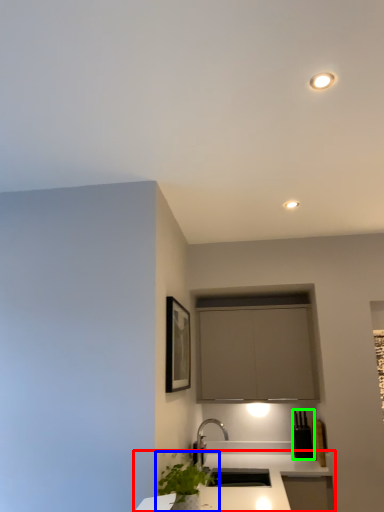
Question: Which is farther away from countertop (highlighted by a red box)? houseplant (highlighted by a blue box) or appliance (highlighted by a green box)?

Choices:
 (A) houseplant
 (B) appliance

Answer: (A)